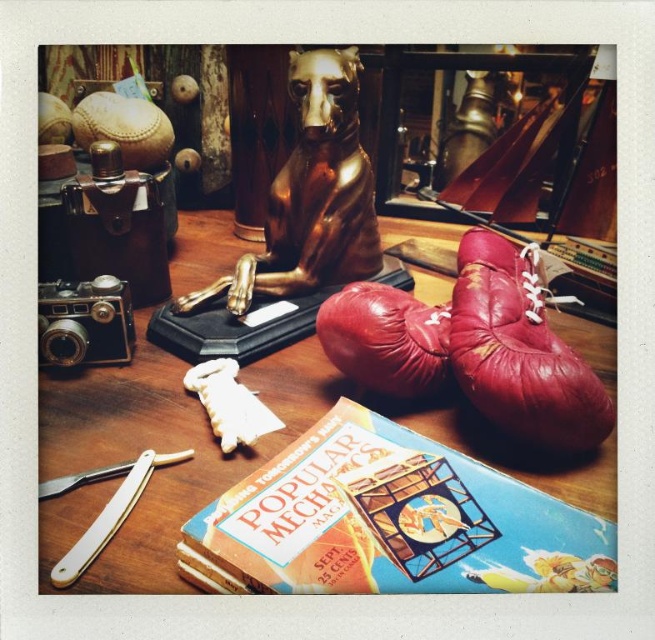
You are a collector organizing a display. You have a wooden table at center and a white plastic razor at lower left. Which object is higher in height?

The wooden table at center is taller than the white plastic razor at lower left.

You are organizing a vintage fair and need to place a decorative item between the wooden table at center and the white plastic razor at lower left. Based on their positions, which object should you place the item closer to?

The decorative item should be placed closer to the white plastic razor at lower left because the wooden table at center is to the right of the white plastic razor at lower left, meaning the razor is positioned further to the left.